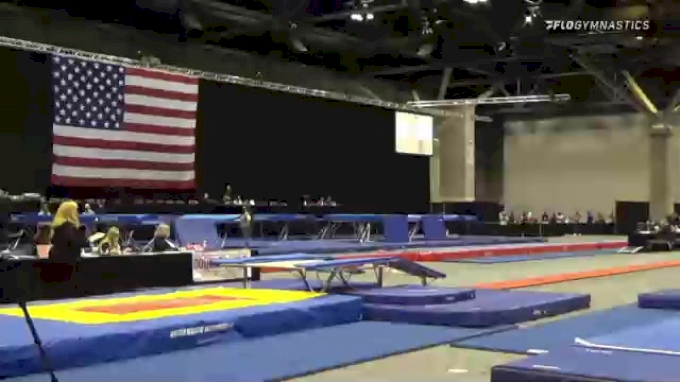
Where is `red mats`? The width and height of the screenshot is (680, 382). red mats is located at coordinates (169, 303), (496, 251).